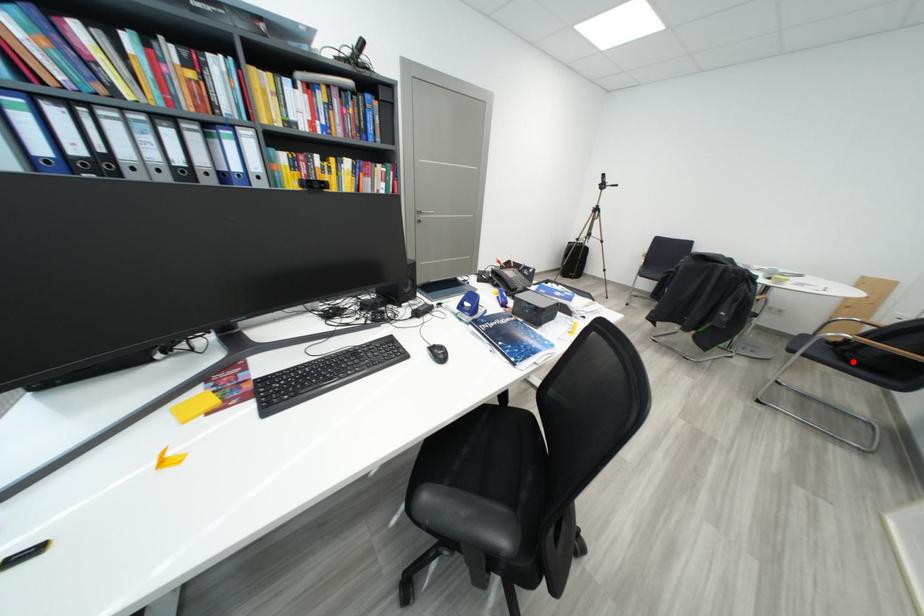
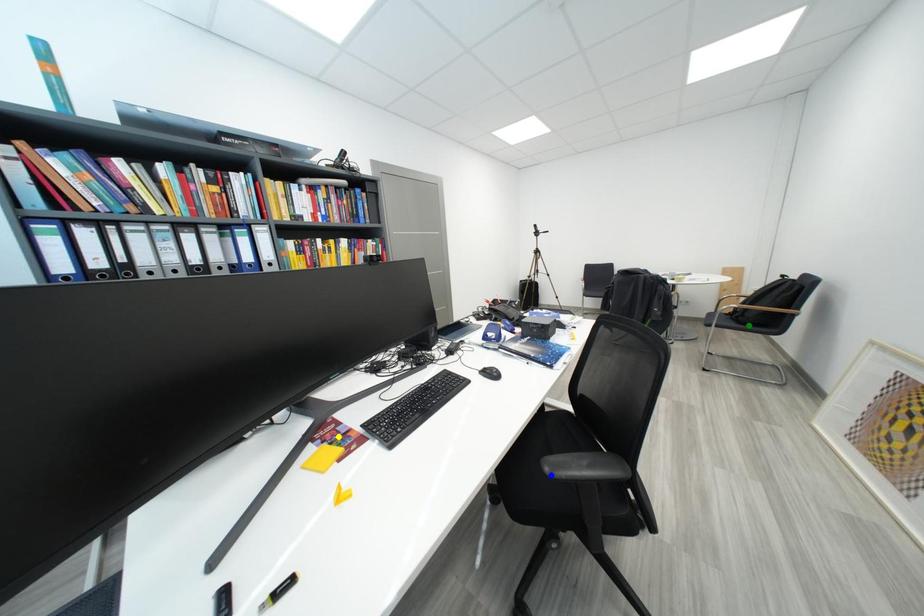
Question: I am providing you with two images of the same scene from different viewpoints. A red point is marked on the first image. You are given multiple points on the second image. Which spot in image 2 lines up with the point in image 1?

Choices:
 (A) green point
 (B) blue point
 (C) yellow point

Answer: (A)